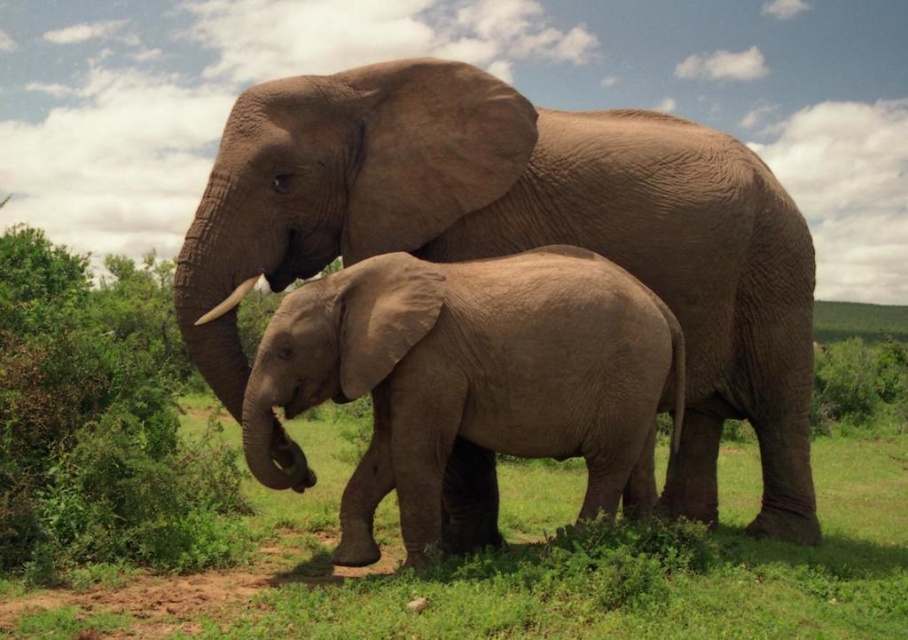
This screenshot has height=640, width=908. What do you see at coordinates (524, 236) in the screenshot?
I see `matte brown elephant at center` at bounding box center [524, 236].

Find the location of a particular element. The image size is (908, 640). matte brown elephant at center is located at coordinates (524, 236).